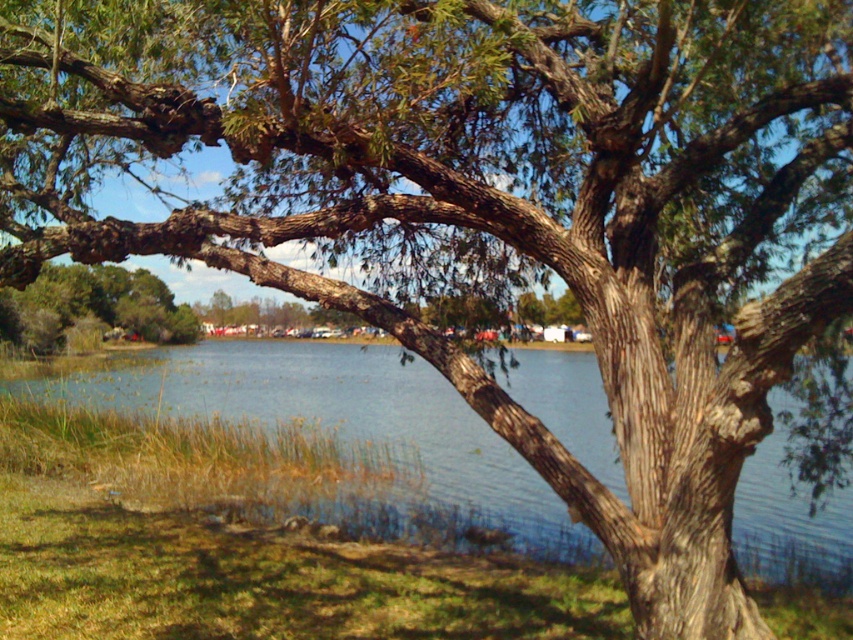
You are standing at the lakeside and want to determine which of the two points, point (764, 497) or point (27, 301), is nearer to you. Based on the scene description, which point is closer?

Point (764, 497) is closer to the viewer than point (27, 301) according to the description.

You are standing at the edge of the lake and want to locate the clear blue water at center. According to the coordinates provided, where would you look relative to your position?

The clear blue water at center is located at coordinates point (344,419), which would be to your right and slightly forward from your current position at the edge of the lake.

You are standing at the point labeled point at point (126, 385) and want to throw a stone to reach the opposite side of the lake. The lake is 100 feet wide. Can you reach the opposite side with one throw if your maximum throw distance is 80 feet?

The distance between you and the opposite side of the lake is 100 feet, which is greater than your maximum throw distance of 80 feet. Therefore, you cannot reach the opposite side with one throw.